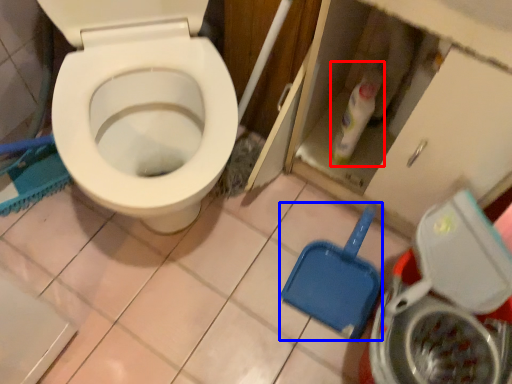
Question: Which of the following is the farthest to the observer, cleaning product (highlighted by a red box) or shovel (highlighted by a blue box)?

Choices:
 (A) cleaning product
 (B) shovel

Answer: (B)